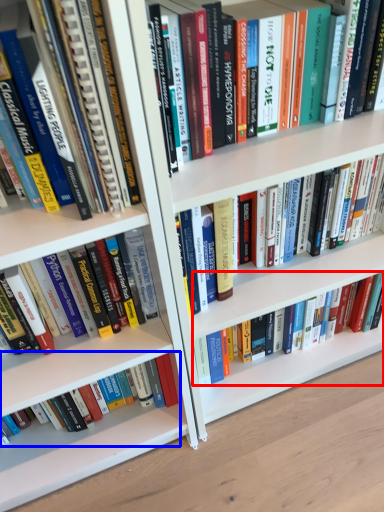
Question: Which point is closer to the camera, book (highlighted by a red box) or book (highlighted by a blue box)?

Choices:
 (A) book
 (B) book

Answer: (B)